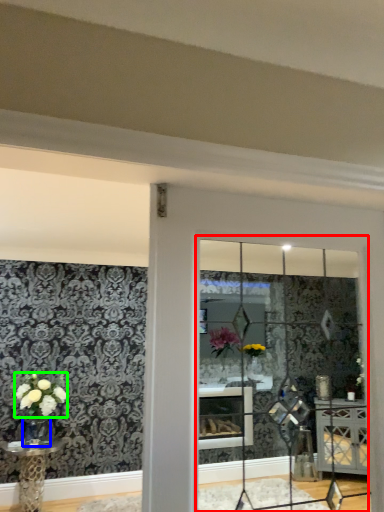
Question: Which is farther away from glass window (highlighted by a red box)? glass vase (highlighted by a blue box) or flower (highlighted by a green box)?

Choices:
 (A) glass vase
 (B) flower

Answer: (A)